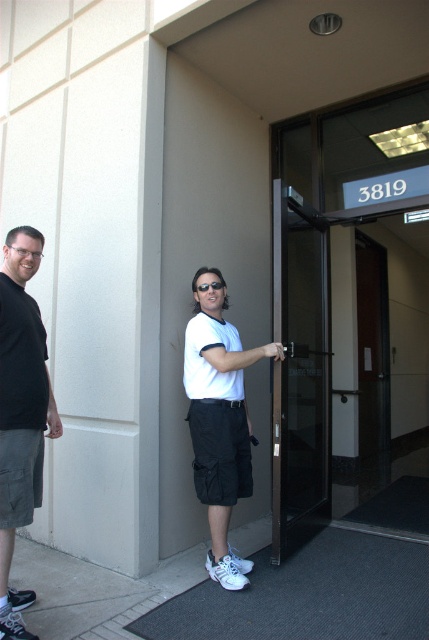
Does transparent glass elevator at center have a lesser width compared to white matte shirt at center?

Indeed, transparent glass elevator at center has a lesser width compared to white matte shirt at center.

Which is more to the right, transparent glass elevator at center or white matte shirt at center?

transparent glass elevator at center is more to the right.

Which is in front, point (404, 285) or point (233, 362)?

Point (233, 362) is more forward.

I want to click on transparent glass elevator at center, so (349, 305).

Can you confirm if black glass door at center is wider than white matte shirt at center?

In fact, black glass door at center might be narrower than white matte shirt at center.

Between black glass door at center and white matte shirt at center, which one is positioned higher?

Positioned higher is black glass door at center.

Find the location of a particular element. This screenshot has height=640, width=429. black glass door at center is located at coordinates (299, 371).

This screenshot has height=640, width=429. Find the location of `black glass door at center`. black glass door at center is located at coordinates point(299,371).

Does point (18, 518) come in front of point (196, 289)?

That is True.

Locate an element on the screen. black cotton shirt at left is located at coordinates (21, 412).